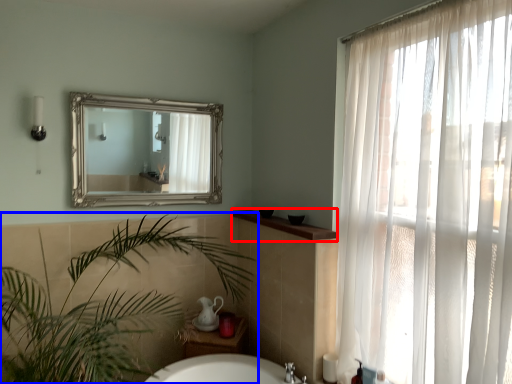
Question: Among these objects, which one is nearest to the camera, counter top (highlighted by a red box) or houseplant (highlighted by a blue box)?

Choices:
 (A) counter top
 (B) houseplant

Answer: (B)